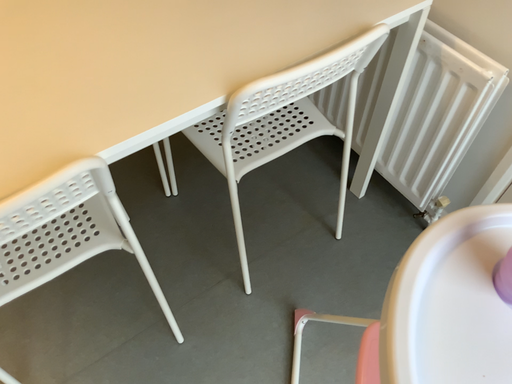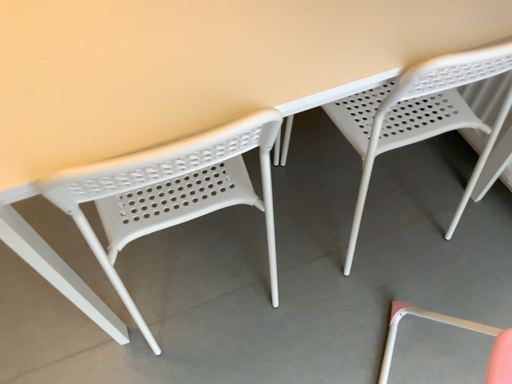
Question: Which way did the camera rotate in the video?

Choices:
 (A) rotated left
 (B) rotated right

Answer: (A)